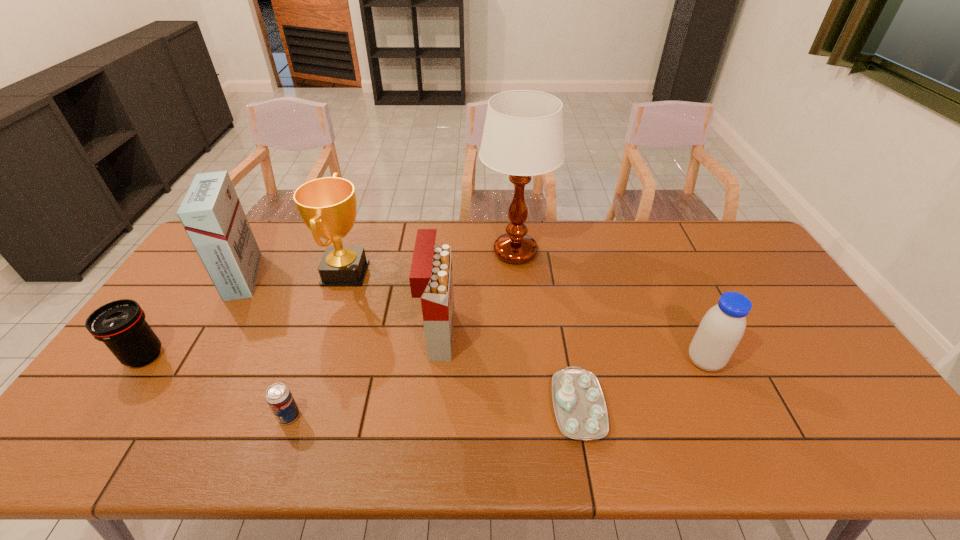
The width and height of the screenshot is (960, 540). I want to click on table lamp, so click(x=523, y=136).

Locate an element on the screen. The height and width of the screenshot is (540, 960). the second object from left to right is located at coordinates (211, 213).

Find the location of a particular element. the left cigarette case is located at coordinates (211, 213).

Where is `award`? award is located at coordinates (328, 206).

You are a GUI agent. You are given a task and a screenshot of the screen. Output one action in this format:
    pyautogui.click(x=<x>, y=<y>)
    Task: Click on the fourth object from right to left
    
    Given the screenshot: What is the action you would take?
    pyautogui.click(x=431, y=279)

Locate an element on the screen. The image size is (960, 540). the nearer cigarette case is located at coordinates (431, 279).

Identify the location of soya milk. The image size is (960, 540). (722, 327).

You are a GUI agent. You are given a task and a screenshot of the screen. Output one action in this format:
    pyautogui.click(x=<x>, y=<y>)
    Task: Click on the fourth shortest object
    Image resolution: width=960 pixels, height=540 pixels.
    Given the screenshot: What is the action you would take?
    pyautogui.click(x=722, y=327)

Locate an element on the screen. This screenshot has height=540, width=960. the third shortest object is located at coordinates (120, 325).

Where is `the leftmost object`? the leftmost object is located at coordinates point(120,325).